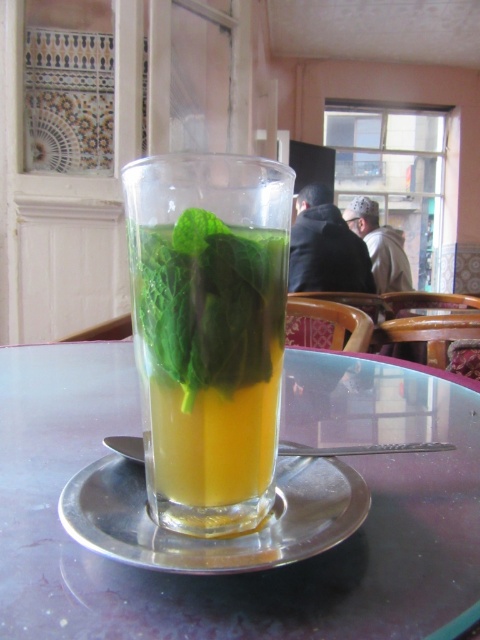
Question: Can you confirm if translucent glass drink at center is smaller than silver metallic plate at center?

Choices:
 (A) yes
 (B) no

Answer: (B)

Question: Based on their relative distances, which object is farther from the translucent glass drink at center?

Choices:
 (A) silver metallic plate at center
 (B) transparent glass table at center
 (C) green leafy mint at center

Answer: (B)

Question: Which of the following is the farthest from the observer?

Choices:
 (A) green leafy mint at center
 (B) silver metallic plate at center

Answer: (A)

Question: Is transparent glass table at center closer to the viewer compared to silver metallic plate at center?

Choices:
 (A) no
 (B) yes

Answer: (B)

Question: Which point is closer to the camera taking this photo?

Choices:
 (A) (178, 365)
 (B) (139, 195)

Answer: (A)

Question: Can you confirm if transparent glass table at center is wider than translucent glass drink at center?

Choices:
 (A) yes
 (B) no

Answer: (A)